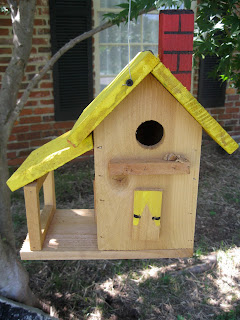
Where is `brick wall`? brick wall is located at coordinates (42, 107).